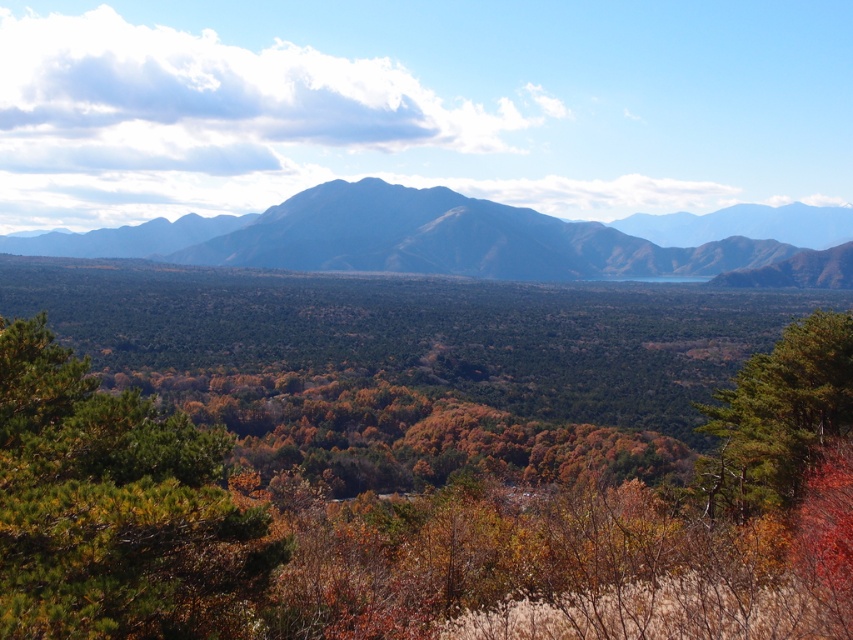
Who is lower down, blue-gray rock formation at center or green matte tree at center?

green matte tree at center is lower down.

Who is more forward, (x=280, y=220) or (x=844, y=353)?

Point (x=844, y=353)

In the scene shown: Measure the distance between point (259, 216) and camera.

2000.65 feet

Find the location of a particular element. The image size is (853, 640). blue-gray rock formation at center is located at coordinates (438, 241).

The width and height of the screenshot is (853, 640). What do you see at coordinates (339, 490) in the screenshot?
I see `green matte forest at center` at bounding box center [339, 490].

The width and height of the screenshot is (853, 640). Describe the element at coordinates (339, 490) in the screenshot. I see `green matte forest at center` at that location.

Where is `green matte forest at center`? green matte forest at center is located at coordinates (339, 490).

Does point (233, 317) come closer to viewer compared to point (456, 218)?

Yes, point (233, 317) is closer to viewer.

Where is `green matte forest at center`? green matte forest at center is located at coordinates (339, 490).